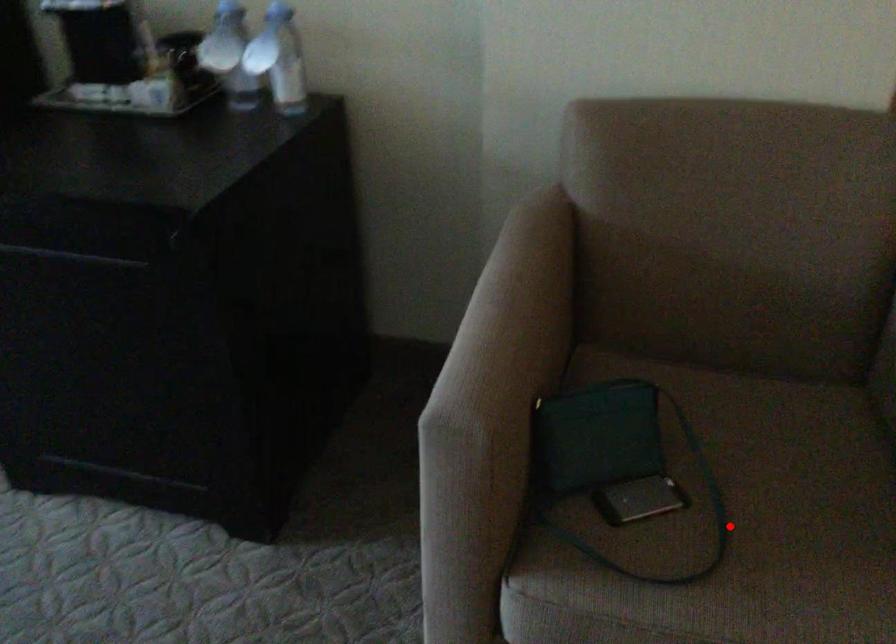
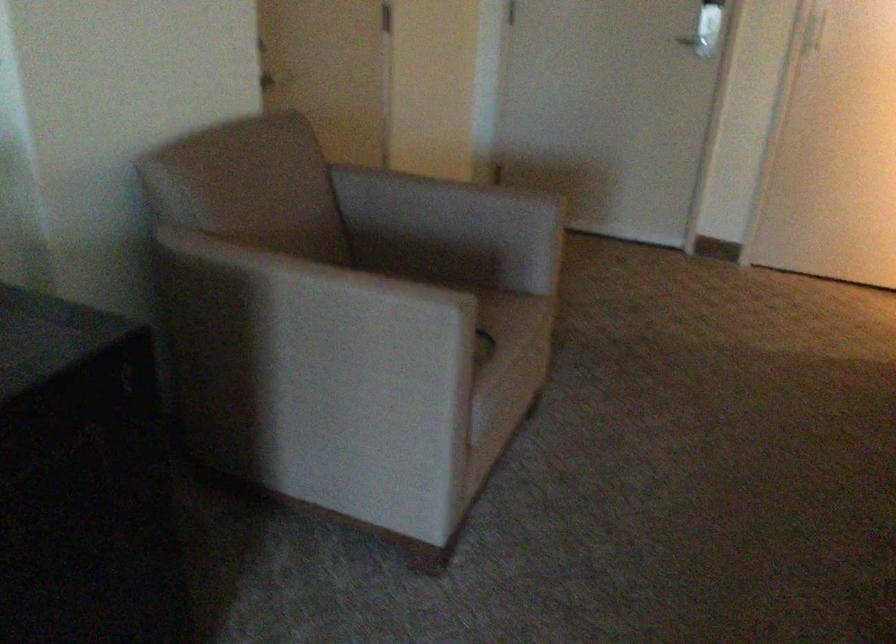
Question: I am providing you with two images of the same scene from different viewpoints. A red point is marked on the first image. Can you still see the location of the red point in image 2?

Choices:
 (A) Yes
 (B) No

Answer: (B)